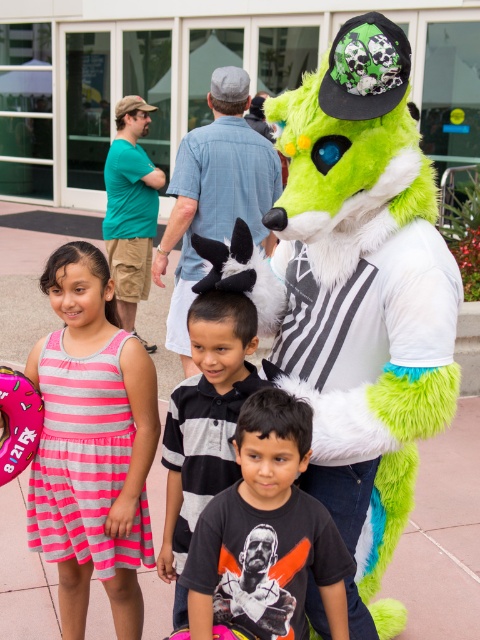
The width and height of the screenshot is (480, 640). Describe the element at coordinates (84, 461) in the screenshot. I see `pink striped dress at left` at that location.

From the picture: How distant is pink striped dress at left from white fur hat at center?

pink striped dress at left and white fur hat at center are 1.66 meters apart.

Who is more forward, (100, 577) or (240, 102)?

Point (100, 577) is in front.

Locate an element on the screen. pink striped dress at left is located at coordinates (84, 461).

Who is higher up, fluffy green costume at center or pink striped dress at left?

fluffy green costume at center

Can you confirm if fluffy green costume at center is shorter than pink striped dress at left?

No.

Identify the location of fluffy green costume at center. (362, 294).

Who is lower down, fluffy green costume at center or black matte shirt at center?

black matte shirt at center

At what (x,y) coordinates should I click in order to perform the action: click on fluffy green costume at center. Please return your answer as a coordinate pair (x, y). Looking at the image, I should click on (362, 294).